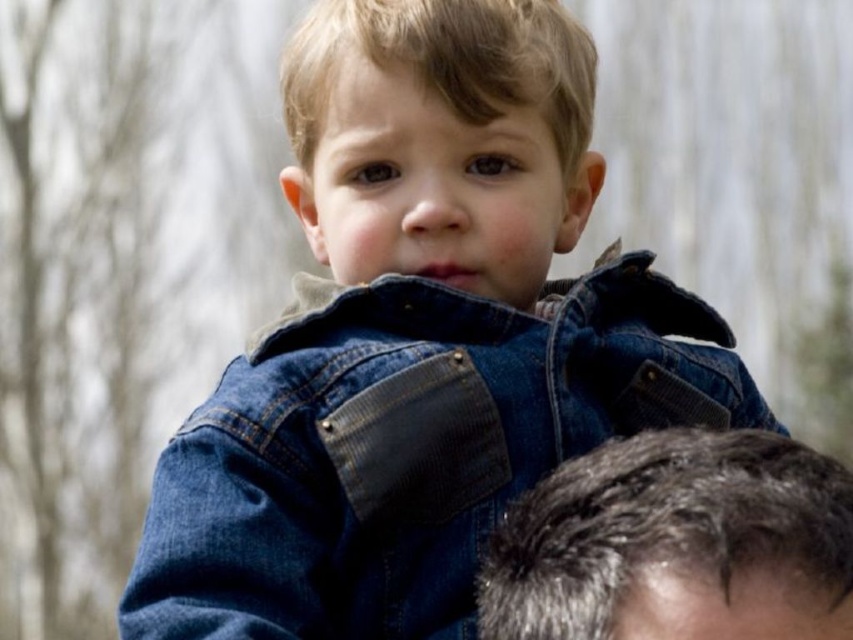
Question: Is denim jacket at center below gray hair at upper right?

Choices:
 (A) yes
 (B) no

Answer: (B)

Question: Is denim jacket at center further to the viewer compared to gray hair at upper right?

Choices:
 (A) yes
 (B) no

Answer: (A)

Question: Which point is farther to the camera?

Choices:
 (A) tap(144, 621)
 (B) tap(612, 624)

Answer: (A)

Question: Where is denim jacket at center located in relation to gray hair at upper right in the image?

Choices:
 (A) left
 (B) right

Answer: (A)

Question: Which object appears closest to the camera in this image?

Choices:
 (A) denim jacket at center
 (B) gray hair at upper right

Answer: (B)